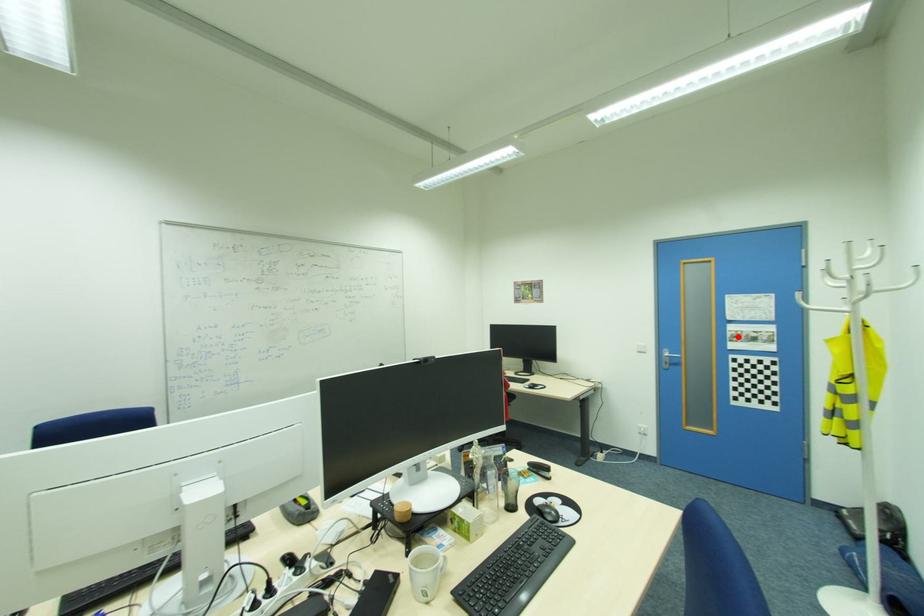
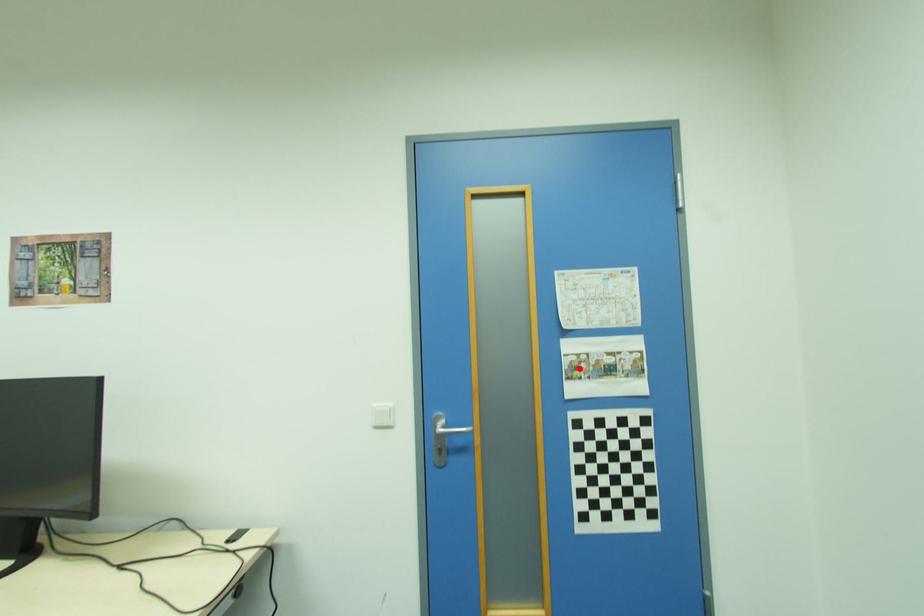
I am providing you with two images of the same scene from different viewpoints. A red point is marked on the first image and another point is marked on the second image. Is the marked point in image1 the same physical position as the marked point in image2?

Yes